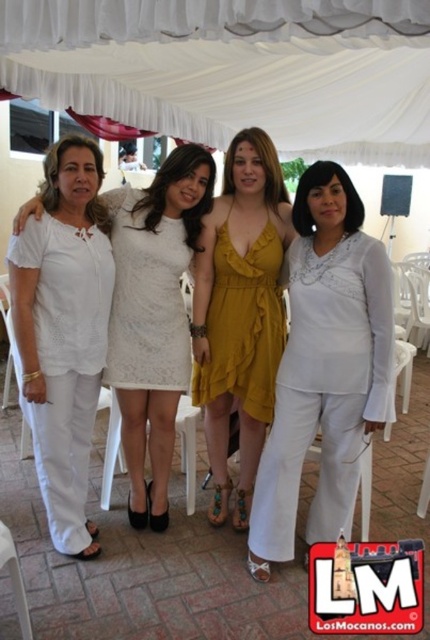
You are a photographer standing at the back of the tent and want to take a photo of the white lace dress at center without the white fabric canopy at upper center blocking the view. Is this possible given their positions?

The white fabric canopy at upper center is further to the viewer than the white lace dress at center, so it is blocking the view. Therefore, you cannot take a photo of the white lace dress at center without the canopy obstructing it.

Based on the scene description, where is the lace white dress at center located in the image?

The lace white dress at center is located at point (147, 300).

You are standing in front of the group of women under the white canopy tent. You notice two specific points marked in the image. The first point is at coordinates point (82,438) and the second is at point (144,518). Which of these two points is nearer to you?

Point (82,438) is closer to the viewer than point (144,518).